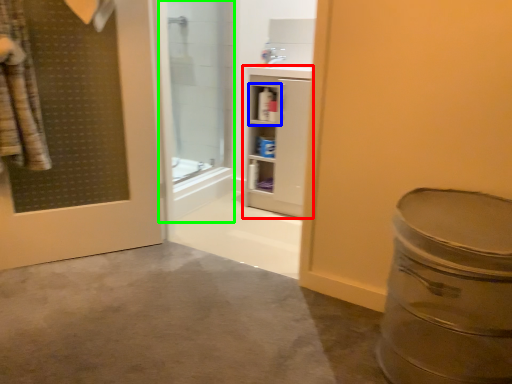
Question: Which is farther away from bathroom cabinet (highlighted by a red box)? cabinet (highlighted by a blue box) or shower door (highlighted by a green box)?

Choices:
 (A) cabinet
 (B) shower door

Answer: (B)